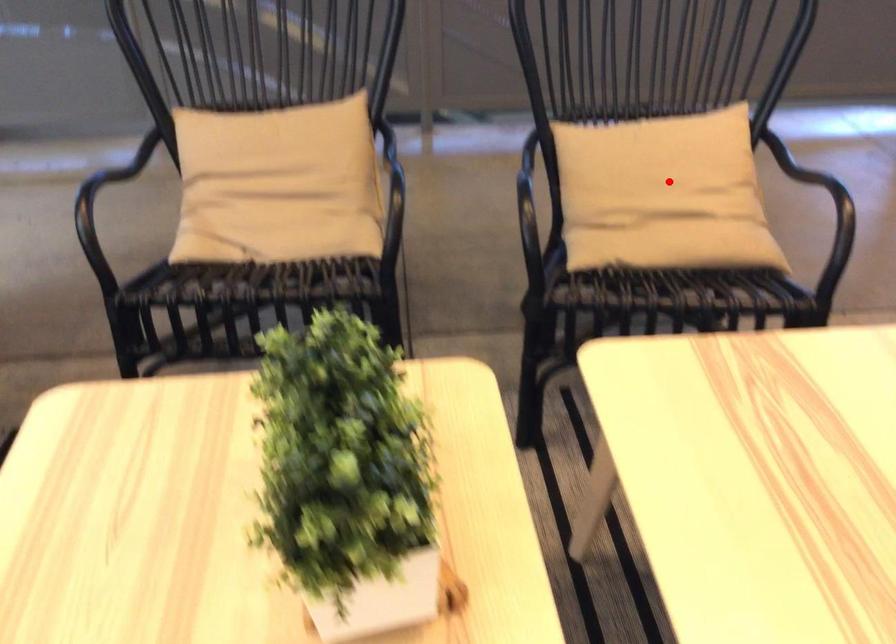
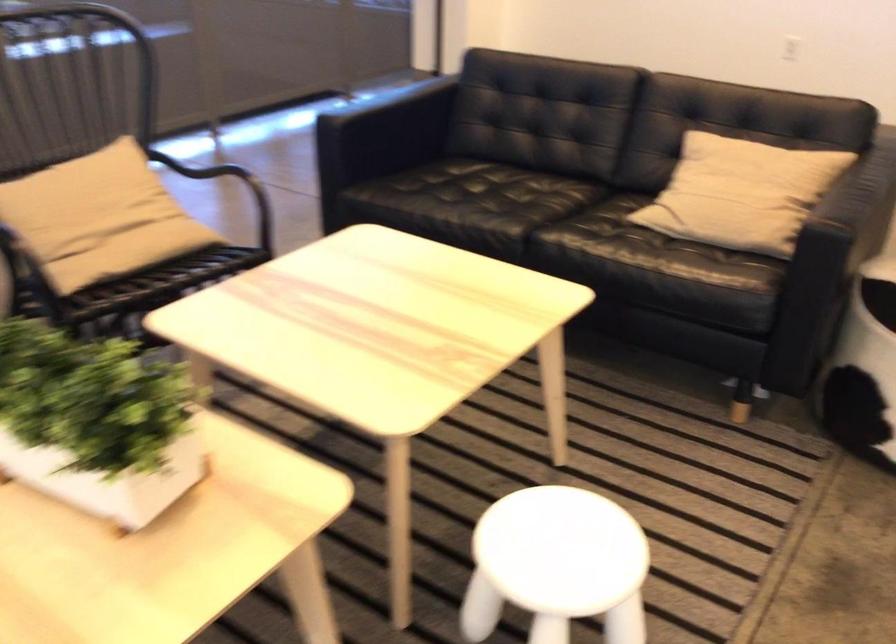
Question: I am providing you with two images of the same scene from different viewpoints. A red point is shown in image1. For the corresponding object point in image2, is it positioned nearer or farther from the camera?

Choices:
 (A) Nearer
 (B) Farther

Answer: (B)